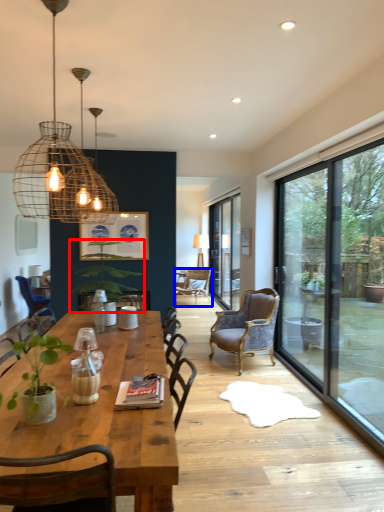
Question: Which object appears farthest to the camera in this image, houseplant (highlighted by a red box) or chair (highlighted by a blue box)?

Choices:
 (A) houseplant
 (B) chair

Answer: (B)